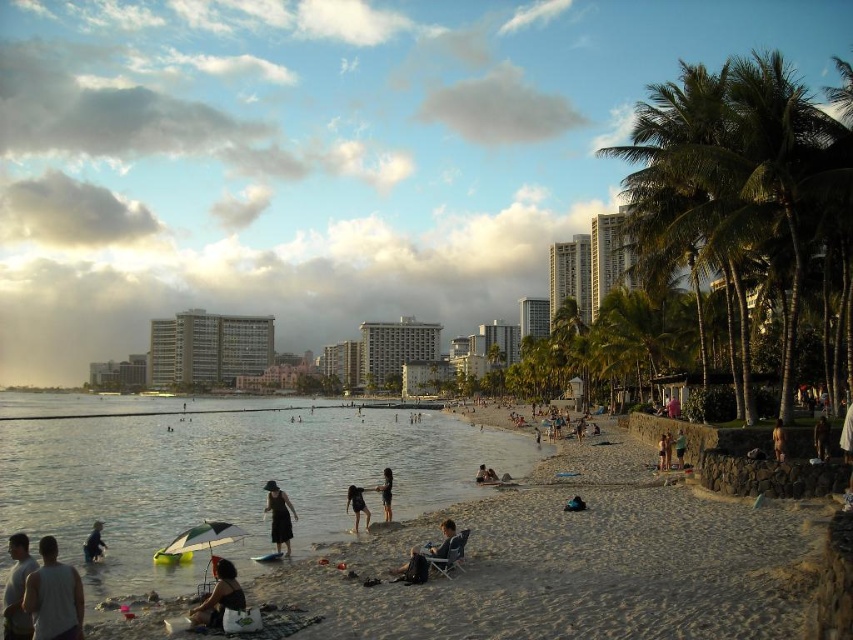
You are a photographer planning to take a sunset photo of the two people wearing the white tank top at lower left and the dark blue fabric dress at lower center. To ensure both subjects are in focus, you need to know their clothing thickness. Which clothing item is thinner?

The white tank top at lower left is thinner than the dark blue fabric dress at lower center according to the description.

Consider the image. You are a photographer trying to capture the sunset at the beach. You have a camera with a 35mm lens and want to include both the white tank top at lower left and the palm trees on the right in your shot. Based on their positions, can you estimate if they will both fit in the frame?

The white tank top at lower left is positioned at point (54, 596), which is very close to the lower right corner of the frame. Since the palm trees are on the right side of the image, they are likely positioned further to the right than the white tank top at lower left. With a 35mm lens, the field of view is wide enough to include both objects in the frame as long as they are within the same general area of the scene.

You are a photographer setting up equipment on the beach. You have a white tank top at lower left and a dark brown leather jacket at lower right. You need to place a camera bag between them. Which side should you place it on to ensure it fits without overlapping either item?

The white tank top at lower left might be wider than the dark brown leather jacket at lower right, so placing the camera bag closer to the narrower dark brown leather jacket at lower right would give more space to avoid overlapping.